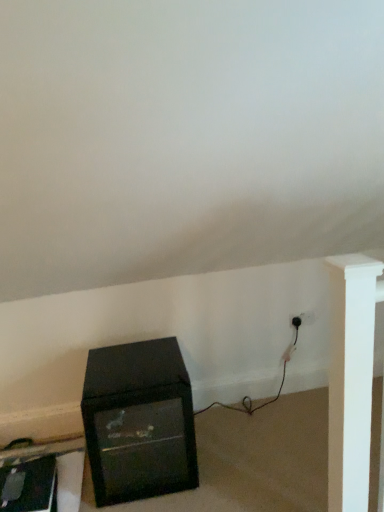
Question: Is black glossy tv at lower left, which appears as the second furniture when viewed from the right, spatially inside black matte cabinet at lower left, which appears as the 1th furniture when viewed from the right, or outside of it?

Choices:
 (A) inside
 (B) outside

Answer: (B)

Question: From the image's perspective, relative to black matte cabinet at lower left, which appears as the 1th furniture when viewed from the right, is black glossy tv at lower left, acting as the first furniture starting from the left, above or below?

Choices:
 (A) below
 (B) above

Answer: (A)

Question: Which is nearer to the black plastic plug at lower right?

Choices:
 (A) black glossy tv at lower left, which appears as the second furniture when viewed from the right
 (B) black matte cabinet at lower left, which appears as the 1th furniture when viewed from the right

Answer: (B)

Question: Which object is the closest to the black plastic plug at lower right?

Choices:
 (A) black matte cabinet at lower left, which is the 2th furniture in left-to-right order
 (B) black glossy tv at lower left, which appears as the second furniture when viewed from the right

Answer: (A)